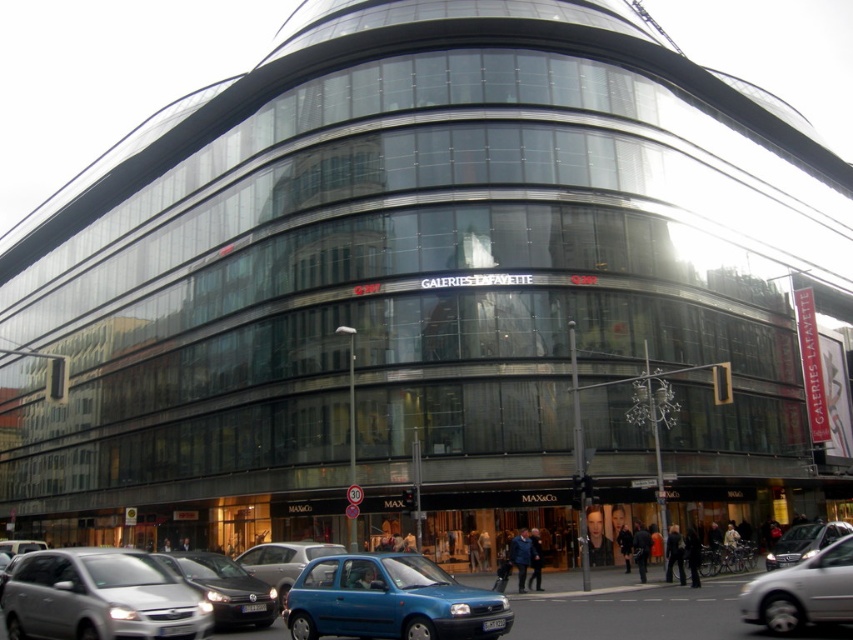
You are standing at the entrance of the Galerie Lafayette building and want to take a photo of the silver metallic car at lower left. Where should you position yourself to capture the car in the frame?

To capture the silver metallic car at lower left in the frame, position yourself at the entrance of the Galerie Lafayette building and aim your camera towards the lower left area, specifically targeting the coordinates point at approximately 0.934 on the x axis and 0.118 on the y axis.

You are standing at the point closest to the Galerie Lafayette building. Which point would you be at, point (x=157, y=612) or point (x=368, y=556)?

Point (x=157, y=612) is in front of point (x=368, y=556), so you would be at point (x=157, y=612) if you are standing closest to the Galerie Lafayette building.

You are a pedestrian standing on the sidewalk in front of the Galerie Lafayette building. You see the silver metallic car at lower left and the matte blue hatchback at lower center. Which car is nearer to you?

The silver metallic car at lower left is closer to the viewer than the matte blue hatchback at lower center, so the silver metallic car at lower left is nearer to you.